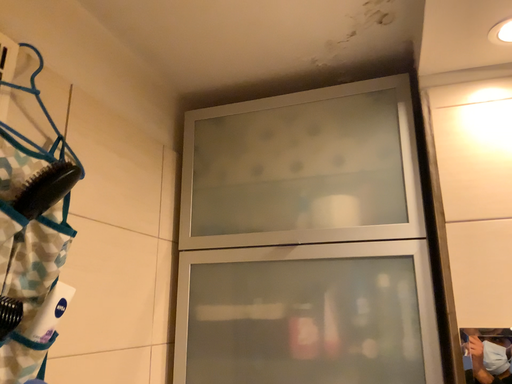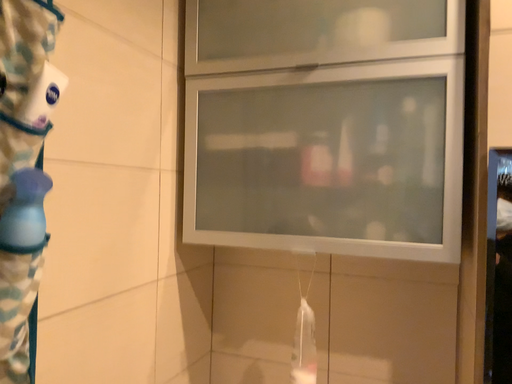
Question: How did the camera likely rotate when shooting the video?

Choices:
 (A) rotated downward
 (B) rotated upward

Answer: (A)